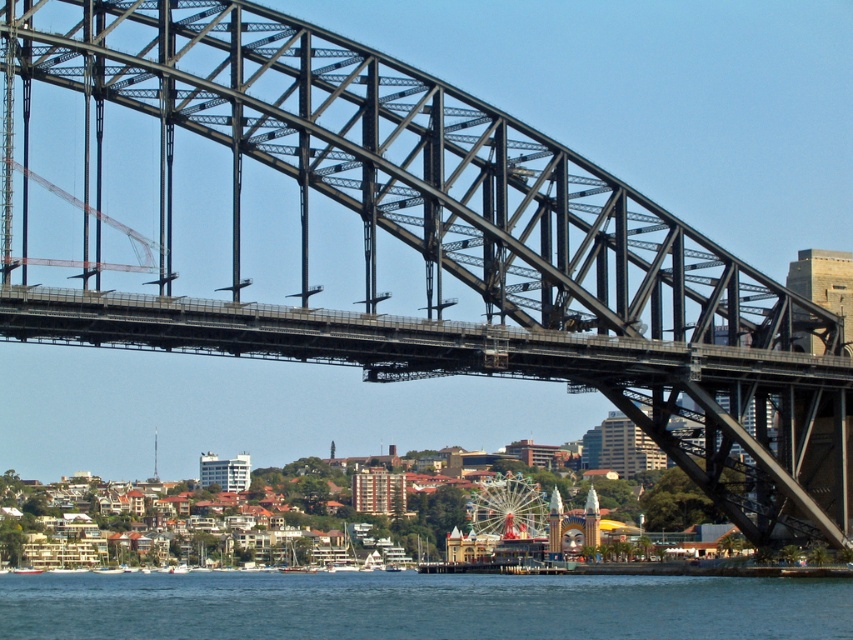
Does point (491, 595) come closer to viewer compared to point (287, 486)?

Yes, point (491, 595) is closer to viewer.

The image size is (853, 640). What are the coordinates of `blue water at lower center` in the screenshot? It's located at (421, 605).